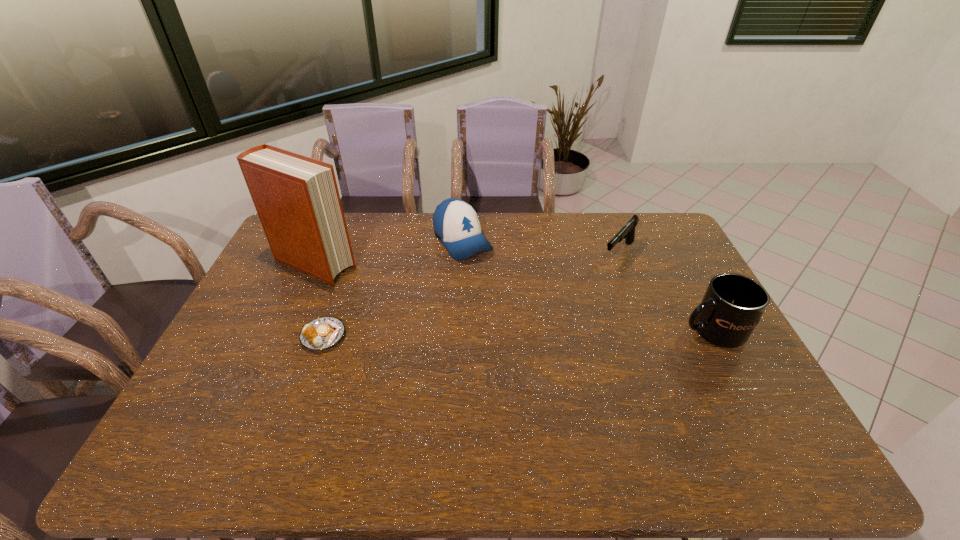
The image size is (960, 540). In order to click on vacant space on the desktop that is between the pastry and the rightmost object and is positioned on the front-facing side of the third object from left to right in this screenshot , I will do `click(542, 333)`.

Image resolution: width=960 pixels, height=540 pixels. Identify the location of free spot on the desktop that is between the pastry and the mug and is positioned on the open cover of the tallest object. (478, 334).

At what (x,y) coordinates should I click in order to perform the action: click on free space on the desktop that is between the shortest object and the rightmost object and is positioned at the aiming end of the gun. Please return your answer as a coordinate pair (x, y). The image size is (960, 540). Looking at the image, I should click on click(x=549, y=333).